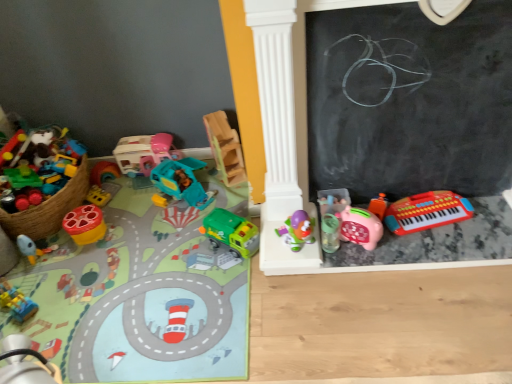
This screenshot has height=384, width=512. What are the coordinates of `vacant area located to the right-hand side of teal plastic car at center, marked as the 7th toy in a right-to-left arrangement` in the screenshot? It's located at (218, 192).